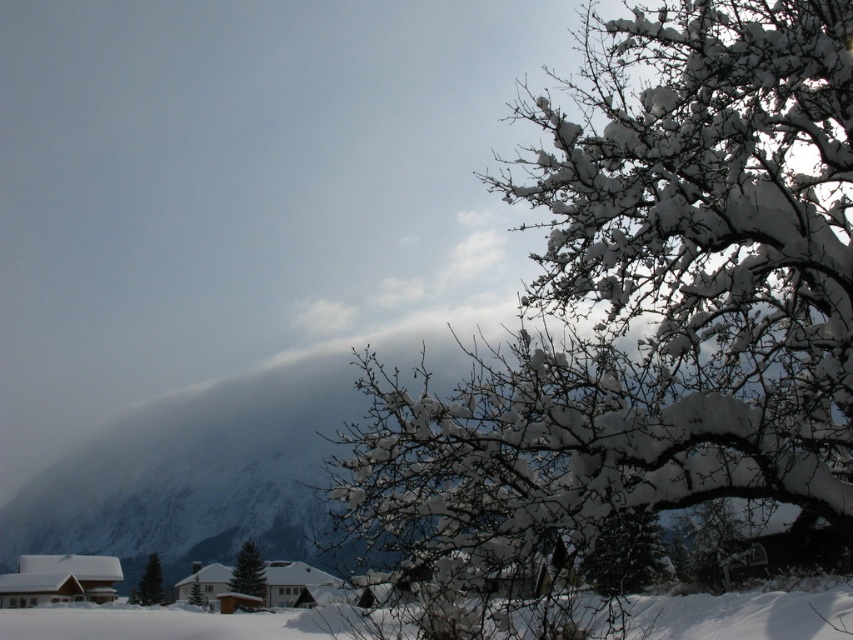
You are standing in the snow and see the green matte tree at lower left and the green matte tree at lower center. Which tree is closer to you?

The green matte tree at lower left is closer to you because it is positioned below the green matte tree at lower center, indicating it is nearer in the scene.